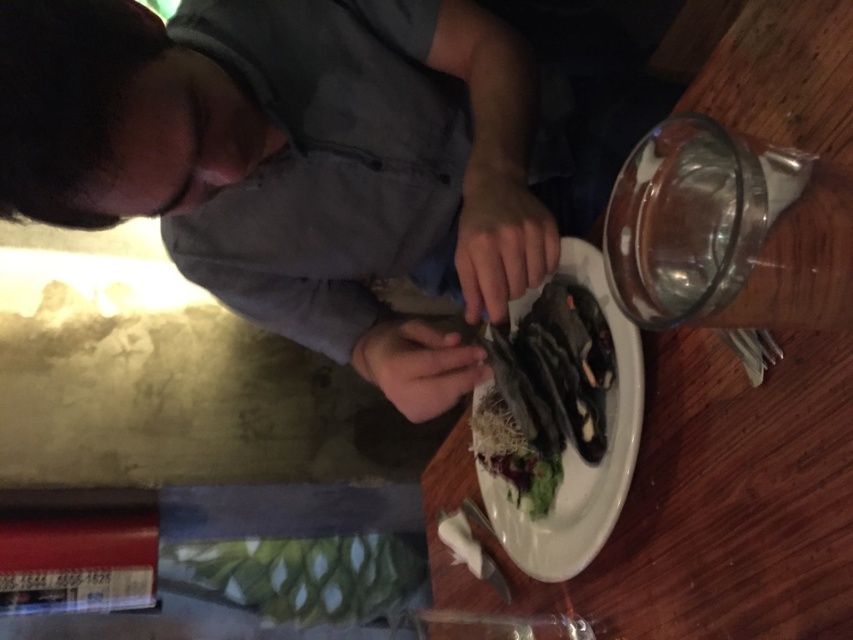
Does gray matte shirt at center have a lesser height compared to wooden table at center?

Correct, gray matte shirt at center is not as tall as wooden table at center.

Who is higher up, gray matte shirt at center or wooden table at center?

gray matte shirt at center

The height and width of the screenshot is (640, 853). I want to click on gray matte shirt at center, so (274, 164).

Which is more to the right, gray matte shirt at center or shiny silver platter at center?

From the viewer's perspective, shiny silver platter at center appears more on the right side.

Who is more distant from viewer, [494,20] or [525,556]?

Point [525,556]

Locate an element on the screen. gray matte shirt at center is located at coordinates (274, 164).

Which is above, wooden table at center or shiny silver platter at center?

Positioned higher is shiny silver platter at center.

Who is lower down, wooden table at center or shiny silver platter at center?

Positioned lower is wooden table at center.

Does point (849, 580) lie behind point (576, 563)?

No, (849, 580) is in front of (576, 563).

I want to click on wooden table at center, so click(x=703, y=502).